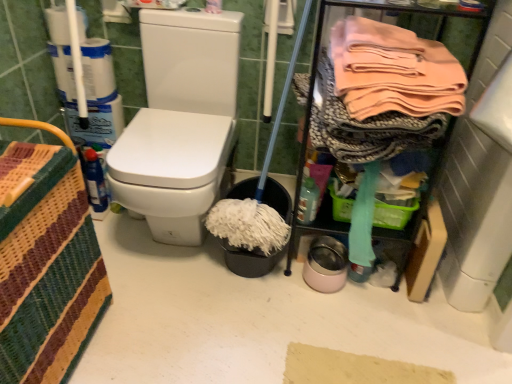
Question: Based on their sizes in the image, would you say translucent plastic bottle at lower right is bigger or smaller than pink fabric at upper right?

Choices:
 (A) big
 (B) small

Answer: (B)

Question: From the image's perspective, is translucent plastic bottle at lower right above or below pink fabric at upper right?

Choices:
 (A) below
 (B) above

Answer: (A)

Question: Which is nearer to the translucent plastic bottle at lower right?

Choices:
 (A) pink fabric at upper right
 (B) white matte toilet paper at upper left
 (C) woven fabric basket at left

Answer: (A)

Question: Considering the real-world distances, which object is farthest from the translucent plastic bottle at lower right?

Choices:
 (A) white matte toilet paper at upper left
 (B) woven fabric basket at left
 (C) pink fabric at upper right

Answer: (A)